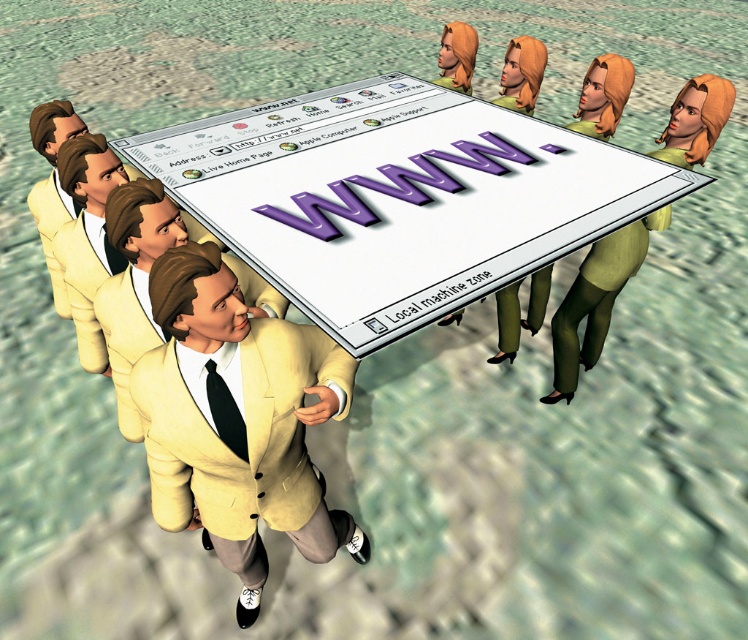
Based on the photo, who is positioned more to the left, green matte dress at right or light yellow fabric business suit at lower left?

light yellow fabric business suit at lower left

Consider the image. Is green matte dress at right taller than light yellow fabric business suit at lower left?

Indeed, green matte dress at right has a greater height compared to light yellow fabric business suit at lower left.

Between point (562, 387) and point (105, 352), which one is positioned in front?

Point (105, 352) is more forward.

The image size is (748, 640). In order to click on green matte dress at right in this screenshot , I will do `click(595, 300)`.

Which is in front, point (318, 513) or point (589, 250)?

Point (318, 513) is in front.

Does matte yellow suit at center appear over green matte dress at right?

Actually, matte yellow suit at center is below green matte dress at right.

Based on the photo, who is more distant from viewer, (275, 448) or (561, 326)?

Point (561, 326)

This screenshot has width=748, height=640. I want to click on matte yellow suit at center, so click(x=245, y=448).

Is matte yellow suit at center further to camera compared to light yellow fabric business suit at lower left?

No, matte yellow suit at center is closer to the viewer.

Can you confirm if matte yellow suit at center is shorter than light yellow fabric business suit at lower left?

In fact, matte yellow suit at center may be taller than light yellow fabric business suit at lower left.

This screenshot has height=640, width=748. I want to click on matte yellow suit at center, so click(245, 448).